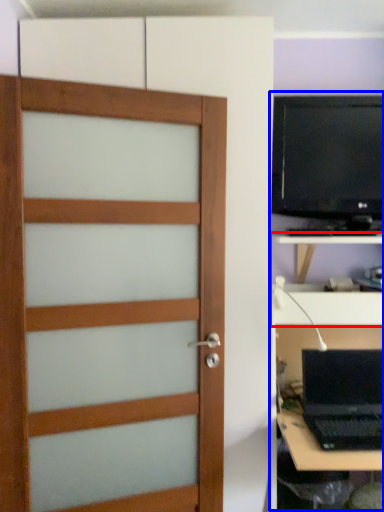
Question: Which object appears farthest to the camera in this image, tv cabinet (highlighted by a red box) or entertainment center (highlighted by a blue box)?

Choices:
 (A) tv cabinet
 (B) entertainment center

Answer: (A)